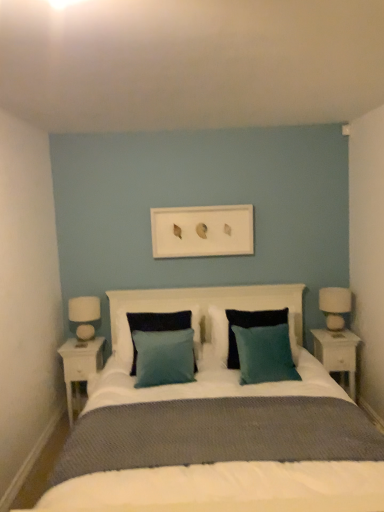
Question: Looking at their shapes, would you say teal fabric pillow at center, positioned as the 1th pillow in left-to-right order, is wider or thinner than teal fabric pillow at center, which is the 2th pillow in left-to-right order?

Choices:
 (A) thin
 (B) wide

Answer: (A)

Question: In the image, is teal fabric pillow at center, which is the 3th pillow in right-to-left order, on the left side or the right side of teal fabric pillow at center, which is the 2th pillow in left-to-right order?

Choices:
 (A) right
 (B) left

Answer: (B)

Question: Which is nearer to the teal fabric pillow at center, positioned as the 1th pillow in left-to-right order?

Choices:
 (A) white wood nightstand at left, acting as the 2th nightstand starting from the right
 (B) white glossy nightstand at right, placed as the second nightstand when sorted from left to right
 (C) white fabric lampshade at right
 (D) teal fabric pillow at center, which ranks as the first pillow in right-to-left order
 (E) white glossy table lamp at left

Answer: (E)

Question: Which object is positioned farthest from the white glossy table lamp at left?

Choices:
 (A) teal fabric pillow at center, the third pillow positioned from the left
 (B) white glossy nightstand at right, placed as the second nightstand when sorted from left to right
 (C) teal fabric pillow at center, positioned as the 1th pillow in left-to-right order
 (D) white wood nightstand at left, acting as the 2th nightstand starting from the right
 (E) white matte picture frame at center

Answer: (B)